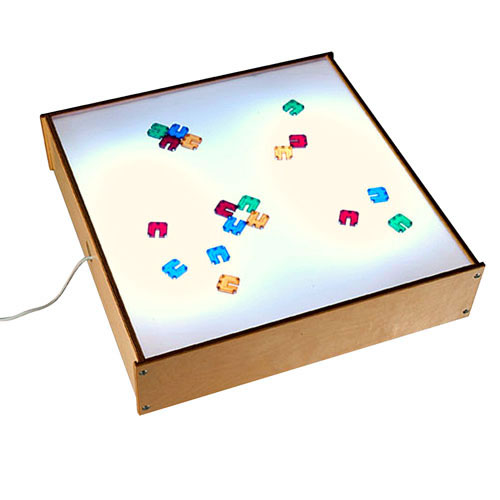
Locate an element on the screen. The height and width of the screenshot is (500, 500). upper left light box corner is located at coordinates (50, 116).